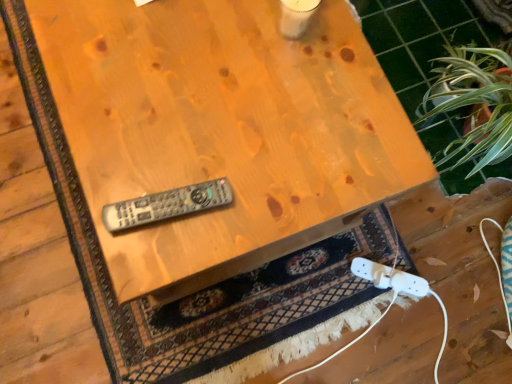
You are a GUI agent. You are given a task and a screenshot of the screen. Output one action in this format:
    pyautogui.click(x=<x>, y=<y>)
    Task: Click on the unoccupied space behind gray plastic remote at center
    This screenshot has width=512, height=384.
    Given the screenshot: What is the action you would take?
    pyautogui.click(x=196, y=129)